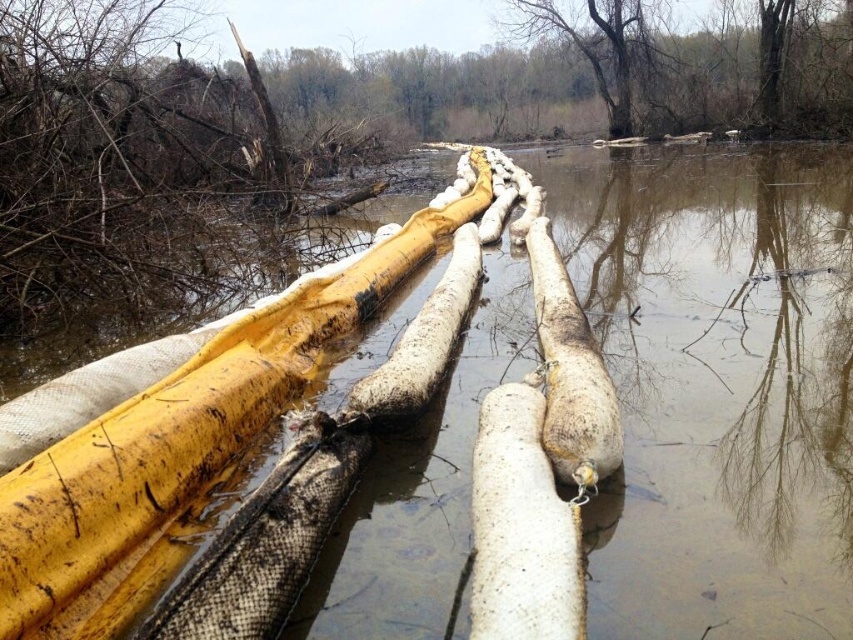
You are a rescue worker trying to reach a stranded person on the other side of the flooded area. You see a white rough log at center and a brown bark tree at upper center. Which object is closer to the water surface?

The white rough log at center is located below the brown bark tree at upper center, so the log is closer to the water surface than the tree.

You are a rescue worker needing to move a heavy equipment from the white rough log at center to the brown bark tree at upper center. The equipment requires a clear path of at least 25 meters. Can you safely transport it using the available space between them?

The distance between the white rough log at center and the brown bark tree at upper center is 26.10 meters, which exceeds the required 25 meters. Therefore, the equipment can be safely transported through the available space between them.

Consider the image. You are standing at the point with coordinates point (596, 22) and want to reach the point with coordinates point (519, 545). Given the flooded area and the makeshift barrier, which direction should you move to reach your destination?

You should move forward because point (519, 545) is in front of point (596, 22), so moving in the forward direction will lead you towards it.